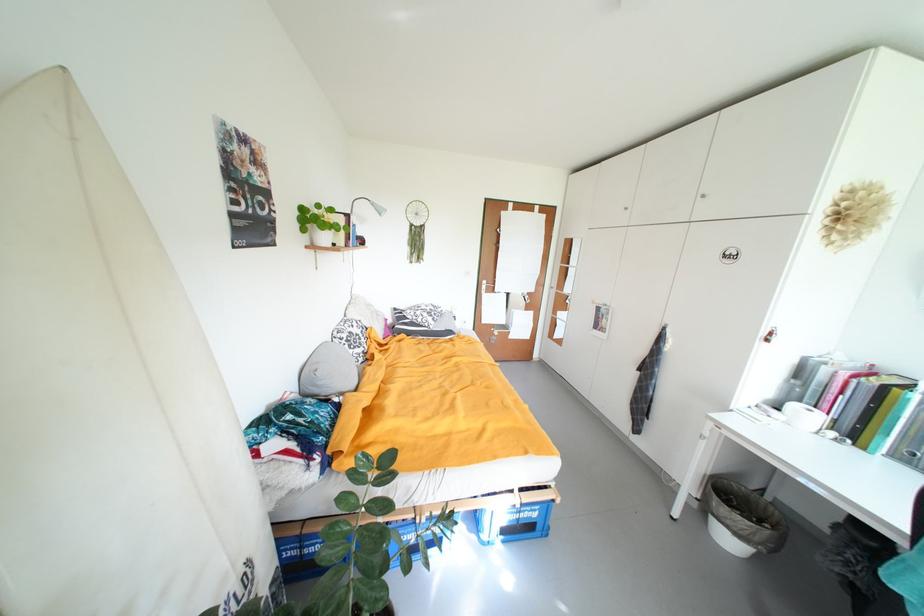
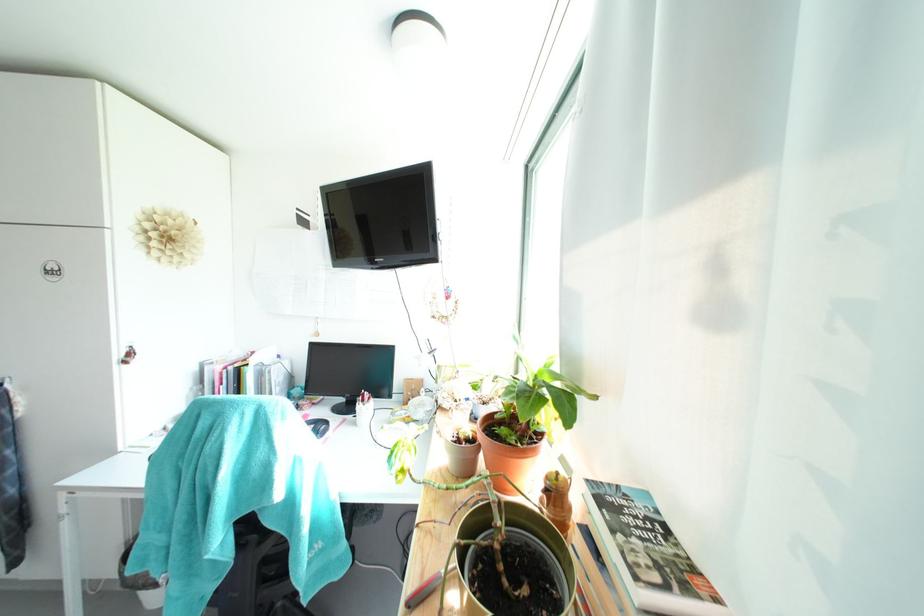
Question: Based on the continuous images, in which direction is the camera rotating? Reply with the corresponding letter.

Choices:
 (A) Left
 (B) Right
 (C) Up
 (D) Down

Answer: (B)